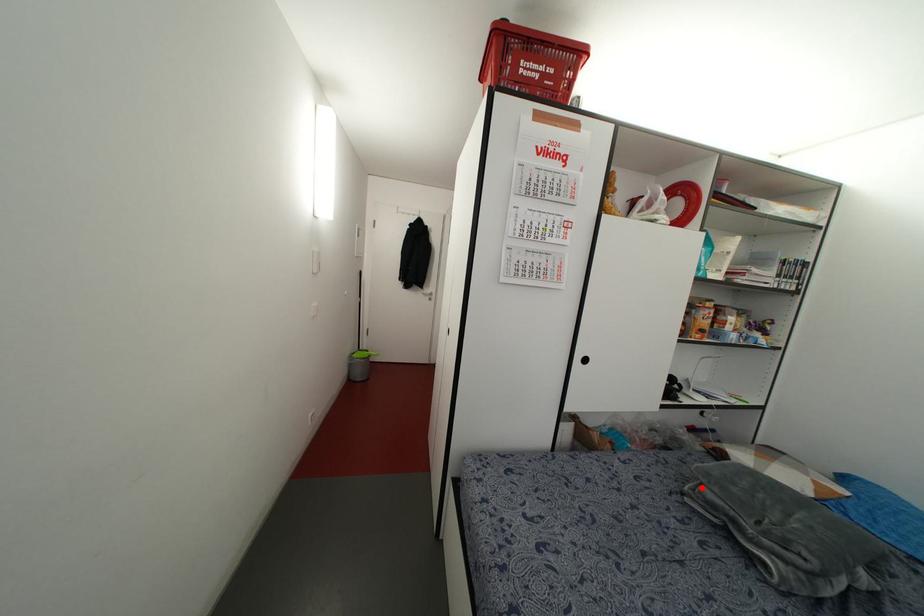
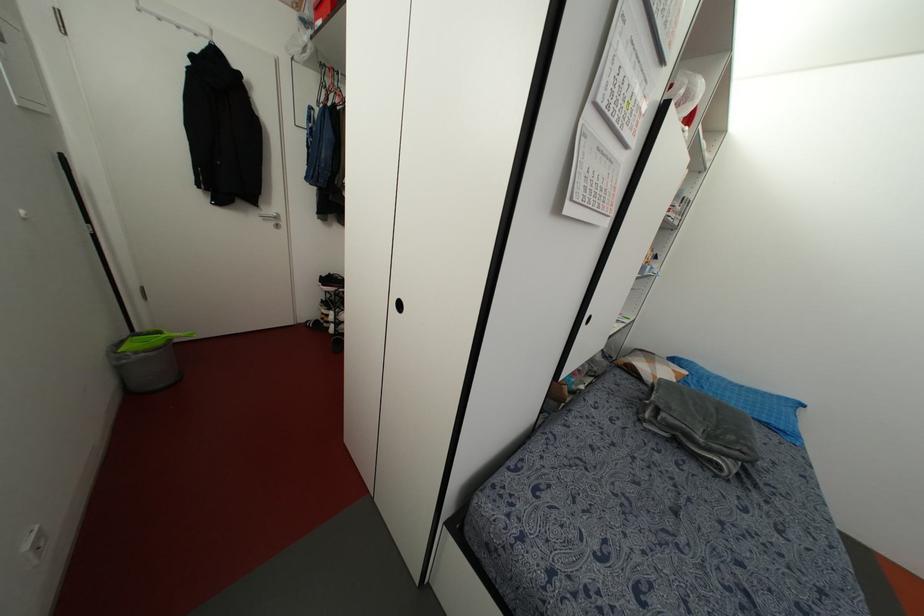
Question: A red point is marked in image1. In image2, is the corresponding 3D point closer to the camera or farther? Reply with the corresponding letter.

Choices:
 (A) The corresponding 3D point is closer.
 (B) The corresponding 3D point is farther.

Answer: (A)